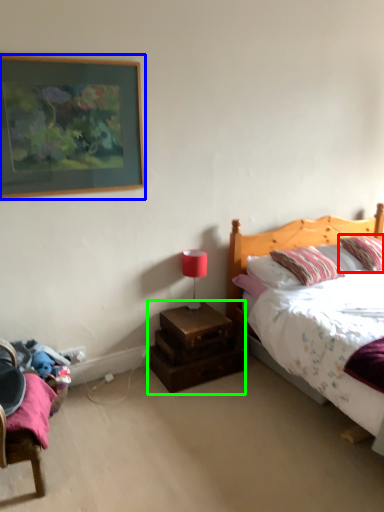
Question: Based on their relative distances, which object is farther from pillow (highlighted by a red box)? Choose from picture frame (highlighted by a blue box) and nightstand (highlighted by a green box).

Choices:
 (A) picture frame
 (B) nightstand

Answer: (A)